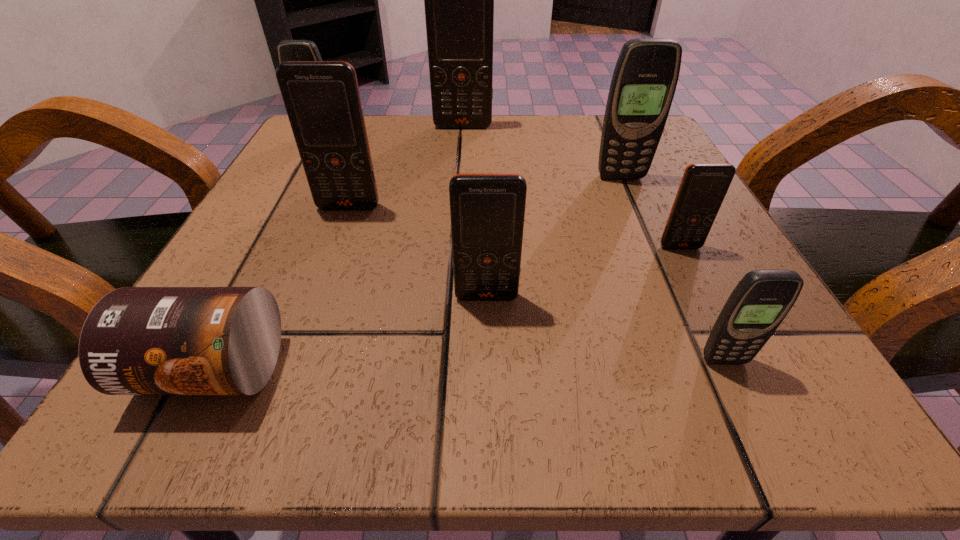
Locate an element on the screen. Image resolution: width=960 pixels, height=540 pixels. the fifth farthest cellular telephone is located at coordinates (703, 187).

Where is `the rightmost orange cellular telephone`? The width and height of the screenshot is (960, 540). the rightmost orange cellular telephone is located at coordinates 703,187.

Find the location of `the nearest gray cellular telephone`. the nearest gray cellular telephone is located at coordinates (759, 303).

Identify the location of the smallest gray cellular telephone. (759, 303).

I want to click on the shortest object, so click(x=136, y=340).

Identify the location of free point located on the screen of the farthest cellular telephone. The image size is (960, 540). (455, 249).

You are a GUI agent. You are given a task and a screenshot of the screen. Output one action in this format:
    pyautogui.click(x=<x>, y=<y>)
    Task: Click on the vacant area situated on the screen of the fourth farthest cellular telephone
    This screenshot has height=540, width=960.
    Given the screenshot: What is the action you would take?
    pyautogui.click(x=339, y=235)

At what (x,y) coordinates should I click in order to perform the action: click on vacant area located 0.160m on the screen of the second nearest gray cellular telephone. Please return your answer as a coordinate pair (x, y). Image resolution: width=960 pixels, height=540 pixels. Looking at the image, I should click on (647, 238).

Find the location of a particular element. blank space located 0.220m on the screen of the leftmost gray cellular telephone is located at coordinates (284, 202).

Identify the location of vacant space located 0.110m on the screen of the nearest orange cellular telephone. (488, 376).